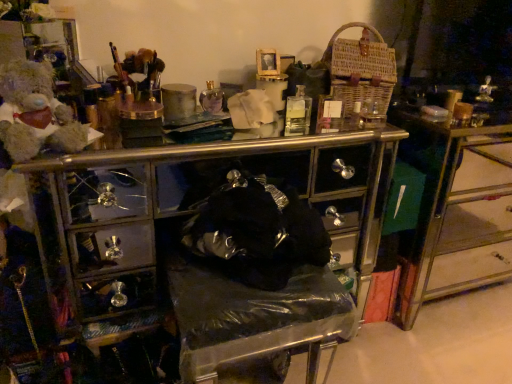
Question: From a real-world perspective, is metallic/golden drawer at right positioned over fluffy beige teddy bear at left based on gravity?

Choices:
 (A) yes
 (B) no

Answer: (B)

Question: From the image's perspective, is metallic/golden drawer at right beneath fluffy beige teddy bear at left?

Choices:
 (A) yes
 (B) no

Answer: (A)

Question: Can you confirm if metallic/golden drawer at right is positioned to the right of fluffy beige teddy bear at left?

Choices:
 (A) no
 (B) yes

Answer: (B)

Question: Would you say metallic/golden drawer at right is a long distance from fluffy beige teddy bear at left?

Choices:
 (A) yes
 (B) no

Answer: (A)

Question: Is metallic/golden drawer at right not inside fluffy beige teddy bear at left?

Choices:
 (A) yes
 (B) no

Answer: (A)

Question: Is woven brown basket at upper right wider or thinner than metallic/golden drawer at right?

Choices:
 (A) thin
 (B) wide

Answer: (A)

Question: Visually, is woven brown basket at upper right positioned to the left or to the right of metallic/golden drawer at right?

Choices:
 (A) right
 (B) left

Answer: (B)

Question: Considering the positions of point (352, 67) and point (458, 130), is point (352, 67) closer or farther from the camera than point (458, 130)?

Choices:
 (A) closer
 (B) farther

Answer: (A)

Question: From their relative heights in the image, would you say woven brown basket at upper right is taller or shorter than metallic/golden drawer at right?

Choices:
 (A) short
 (B) tall

Answer: (A)

Question: Based on their sizes in the image, would you say woven brown basket at upper right is bigger or smaller than fluffy beige teddy bear at left?

Choices:
 (A) big
 (B) small

Answer: (A)

Question: In terms of height, does woven brown basket at upper right look taller or shorter compared to fluffy beige teddy bear at left?

Choices:
 (A) short
 (B) tall

Answer: (B)

Question: Considering the relative positions of woven brown basket at upper right and fluffy beige teddy bear at left in the image provided, is woven brown basket at upper right to the left or to the right of fluffy beige teddy bear at left?

Choices:
 (A) left
 (B) right

Answer: (B)

Question: Which is correct: woven brown basket at upper right is inside fluffy beige teddy bear at left, or outside of it?

Choices:
 (A) inside
 (B) outside

Answer: (B)

Question: From a real-world perspective, is metallic/golden drawer at right above or below woven brown basket at upper right?

Choices:
 (A) above
 (B) below

Answer: (B)

Question: Would you say metallic/golden drawer at right is to the left or to the right of woven brown basket at upper right in the picture?

Choices:
 (A) left
 (B) right

Answer: (B)